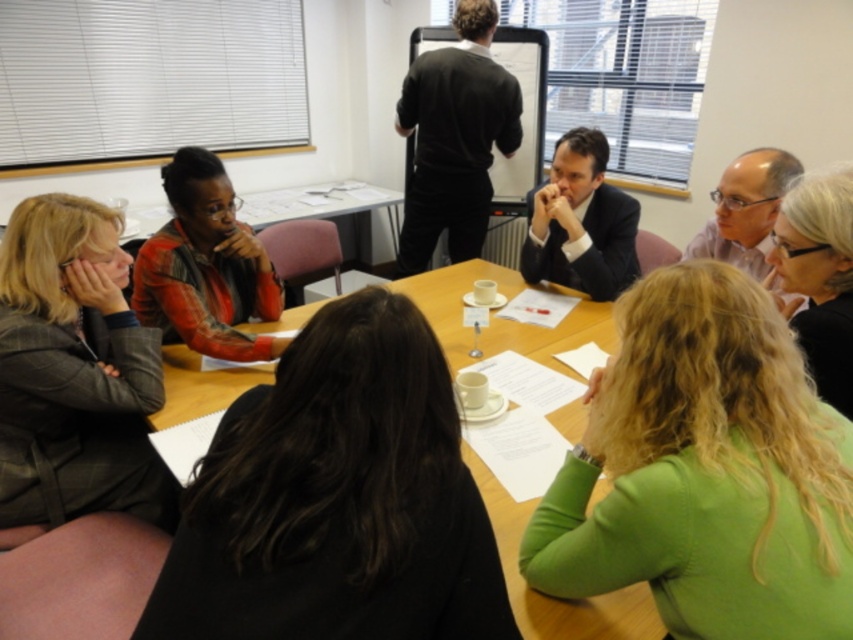
You are sitting at the wooden table in the meeting room. You need to place a small object exactly halfway between the point at coordinate (717, 340) and the point at coordinate (573, 156). What are the coordinates of the midpoint?

The midpoint between the two points can be calculated by averaging their coordinates. The x coordinate is 0.533 and 0.244, so the average is 0.3885. The y coordinate is 0.842 and 0.673, so the average is 0.7575. Therefore, the midpoint is at approximately 0.389, 0.758.

You are a photographer taking a picture of the scene. The dark brown hair at center is located at point (337, 499). If you want to focus on the dark brown hair at center, which coordinate should you adjust your camera to aim at?

The dark brown hair at center is represented by point (337, 499), so you should aim your camera at coordinates (337, 499) to focus on it.

You are organizing a small event and need to place a 4 feet long tablecloth between the green fabric shirt at lower right and the plaid wool blazer at left. Will the tablecloth fit between them?

The distance between the green fabric shirt at lower right and the plaid wool blazer at left is 3.82 feet. Since the tablecloth is 4 feet long, it will be slightly too long to fit between them without overlapping or needing adjustment.